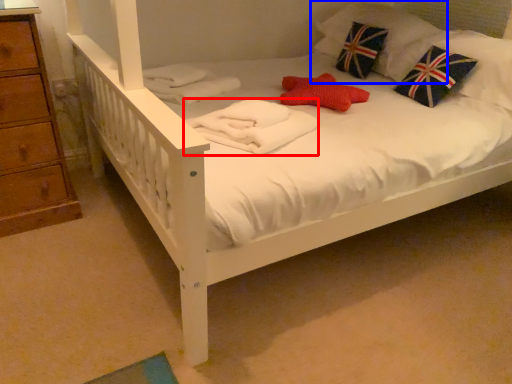
Question: Which object appears farthest to the camera in this image, material (highlighted by a red box) or pillow (highlighted by a blue box)?

Choices:
 (A) material
 (B) pillow

Answer: (B)